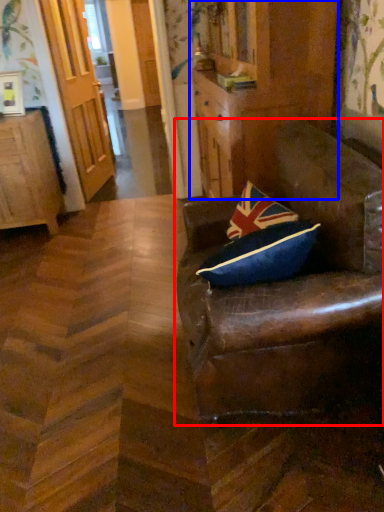
Question: Which object appears closest to the camera in this image, chair (highlighted by a red box) or dresser (highlighted by a blue box)?

Choices:
 (A) chair
 (B) dresser

Answer: (A)